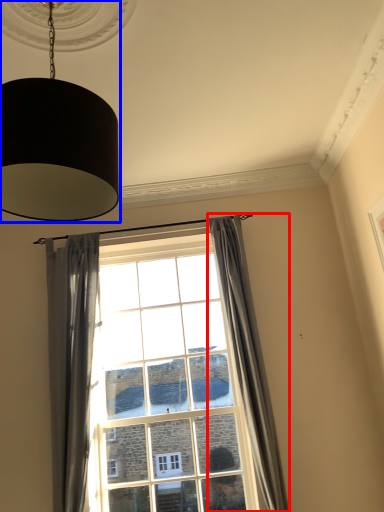
Question: Which object appears farthest to the camera in this image, curtain (highlighted by a red box) or lamp (highlighted by a blue box)?

Choices:
 (A) curtain
 (B) lamp

Answer: (A)